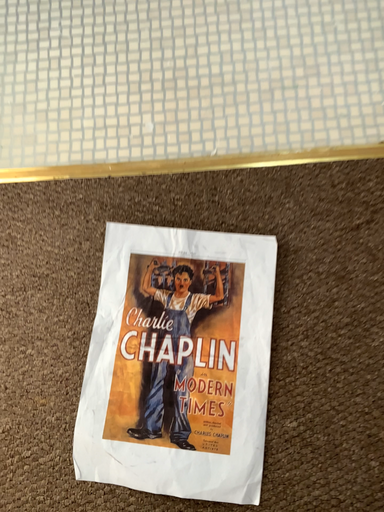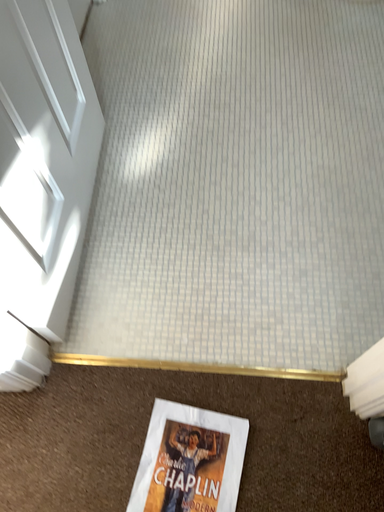
Question: Which way did the camera rotate in the video?

Choices:
 (A) rotated downward
 (B) rotated upward

Answer: (B)